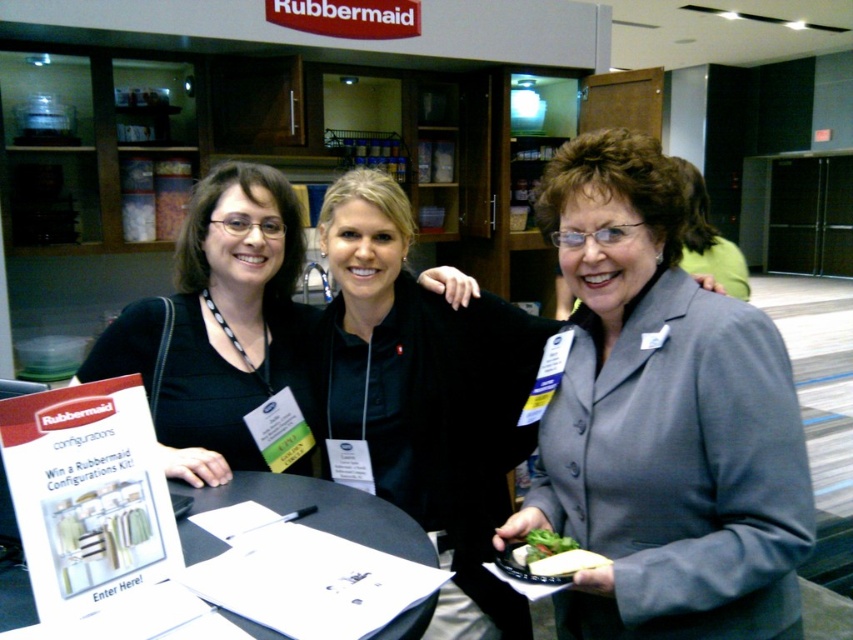
Measure the distance between point [444,282] and camera.

A: Point [444,282] and camera are 5.35 feet apart.

Is point (419, 490) closer to viewer compared to point (28, 586)?

No, it is not.

Between point (407, 419) and point (381, 500), which one is positioned in front?

Point (381, 500)

In order to click on gray fabric suit at center in this screenshot , I will do pos(427,392).

Who is positioned more to the right, gray matte blazer at center or black fabric shirt at upper left?

gray matte blazer at center is more to the right.

Is point (581, 612) positioned before point (187, 273)?

That is True.

Locate an element on the screen. This screenshot has height=640, width=853. gray matte blazer at center is located at coordinates (662, 420).

Can you confirm if black fabric shirt at upper left is positioned above green leafy salad at center?

Yes, black fabric shirt at upper left is above green leafy salad at center.

Can you confirm if black fabric shirt at upper left is thinner than green leafy salad at center?

No, black fabric shirt at upper left is not thinner than green leafy salad at center.

The height and width of the screenshot is (640, 853). I want to click on black fabric shirt at upper left, so click(x=219, y=324).